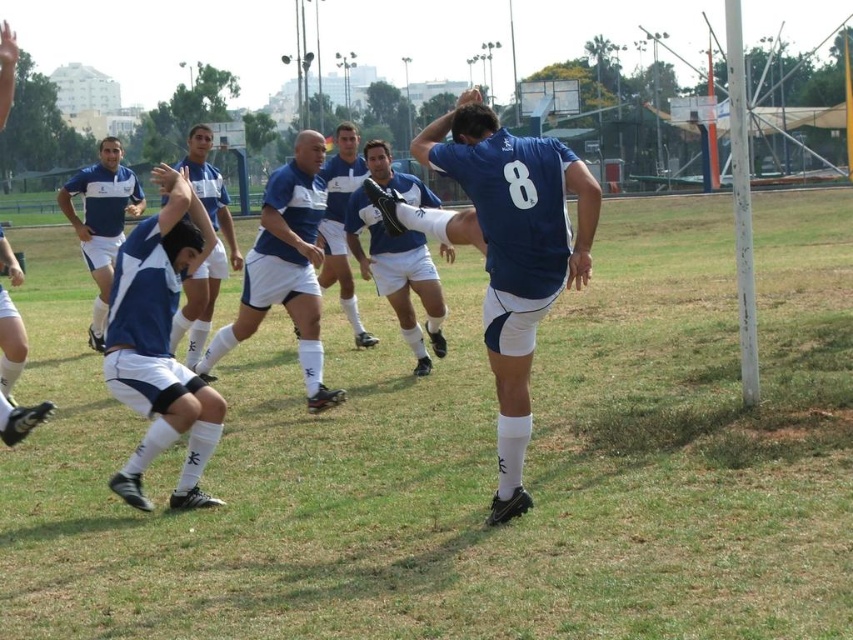
Does blue matte uniform at center have a larger size compared to blue matte soccer player at center?

Yes.

Is blue matte uniform at center behind blue matte soccer player at center?

No, blue matte uniform at center is in front of blue matte soccer player at center.

What do you see at coordinates (286, 268) in the screenshot? I see `blue matte uniform at center` at bounding box center [286, 268].

The height and width of the screenshot is (640, 853). What are the coordinates of `blue matte uniform at center` in the screenshot? It's located at (286, 268).

Does blue matte shorts at center appear over blue jersey at center?

Incorrect, blue matte shorts at center is not positioned above blue jersey at center.

Can you confirm if blue matte shorts at center is bigger than blue jersey at center?

No, blue matte shorts at center is not bigger than blue jersey at center.

Between point (418, 340) and point (210, 268), which one is positioned behind?

The point (210, 268) is more distant.

Where is `blue matte shorts at center`? The width and height of the screenshot is (853, 640). blue matte shorts at center is located at coordinates (398, 275).

How much distance is there between matte blue shorts at center and blue matte shorts at center?

They are 3.17 meters apart.

Locate an element on the screen. The height and width of the screenshot is (640, 853). matte blue shorts at center is located at coordinates (160, 344).